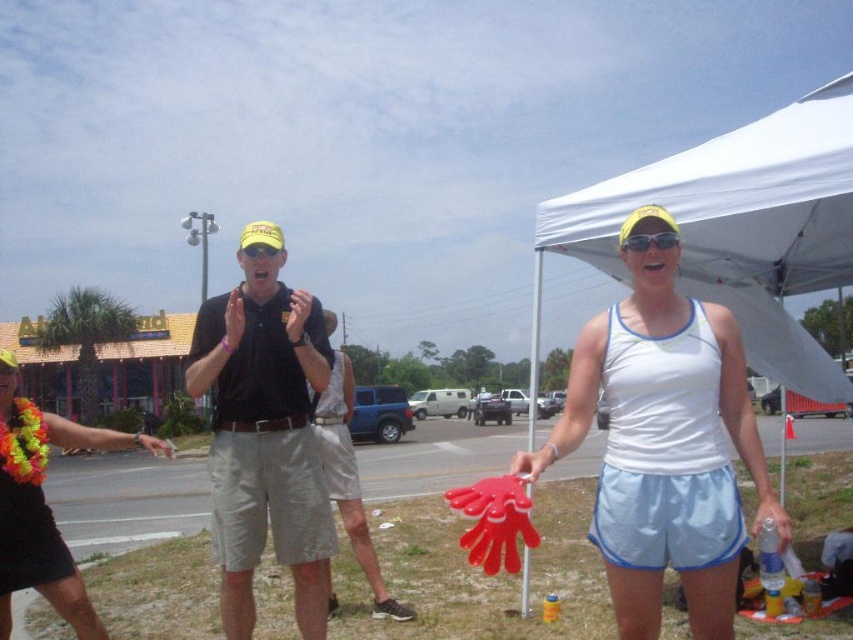
You are a photographer trying to capture a photo of the floral lei at center and the sunglassestransparent at upper center. Which object is positioned higher in the frame?

The sunglassestransparent at upper center is positioned higher in the frame than the floral lei at center.

You are planning to set up a picnic blanket under the white fabric canopy at upper right. Based on the coordinates provided in the Objects Description, can you confirm if the canopy is positioned at the upper right corner of the image?

The white fabric canopy at upper right is located at point coordinates (x=741, y=227), which places it in the upper right corner of the image.

You are standing in the outdoor gathering and want to locate the black matte shirt at center and the matte yellow goggles at center. From your perspective, which object is positioned to the left?

The black matte shirt at center is positioned to the left of the matte yellow goggles at center.